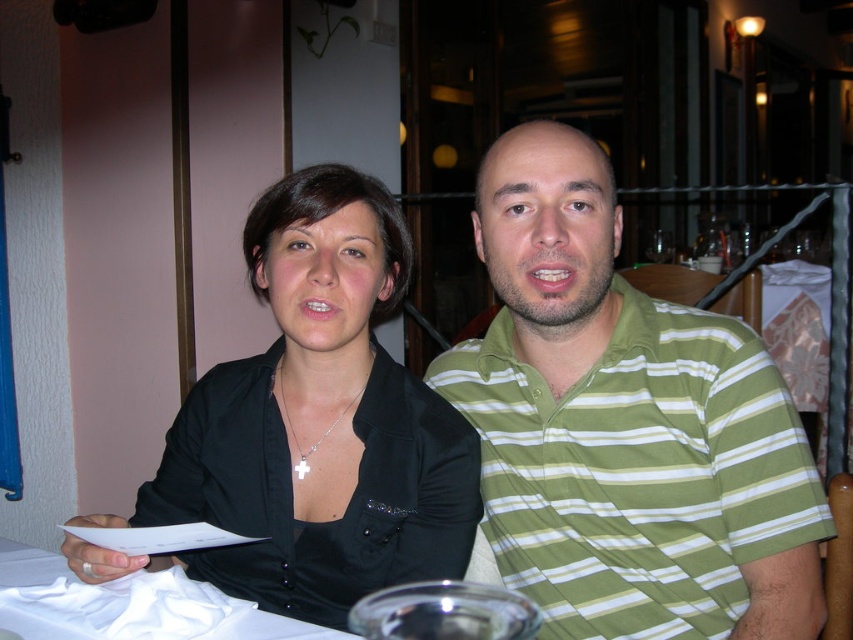
Is black matte shirt at center to the right of white cloth at lower left from the viewer's perspective?

Indeed, black matte shirt at center is positioned on the right side of white cloth at lower left.

Is black matte shirt at center bigger than white cloth at lower left?

Correct, black matte shirt at center is larger in size than white cloth at lower left.

Image resolution: width=853 pixels, height=640 pixels. What do you see at coordinates (318, 420) in the screenshot?
I see `black matte shirt at center` at bounding box center [318, 420].

At what (x,y) coordinates should I click in order to perform the action: click on black matte shirt at center. Please return your answer as a coordinate pair (x, y). Looking at the image, I should click on (318, 420).

What do you see at coordinates (625, 426) in the screenshot?
I see `green striped polo shirt at center` at bounding box center [625, 426].

Who is positioned more to the left, green striped polo shirt at center or white cloth at lower left?

white cloth at lower left is more to the left.

The image size is (853, 640). Describe the element at coordinates (625, 426) in the screenshot. I see `green striped polo shirt at center` at that location.

Locate an element on the screen. The width and height of the screenshot is (853, 640). green striped polo shirt at center is located at coordinates (625, 426).

Is point (749, 387) less distant than point (242, 369)?

Yes, point (749, 387) is closer to viewer.

Can you confirm if green striped polo shirt at center is bigger than black matte shirt at center?

No, green striped polo shirt at center is not bigger than black matte shirt at center.

Where is `green striped polo shirt at center`? This screenshot has width=853, height=640. green striped polo shirt at center is located at coordinates (625, 426).